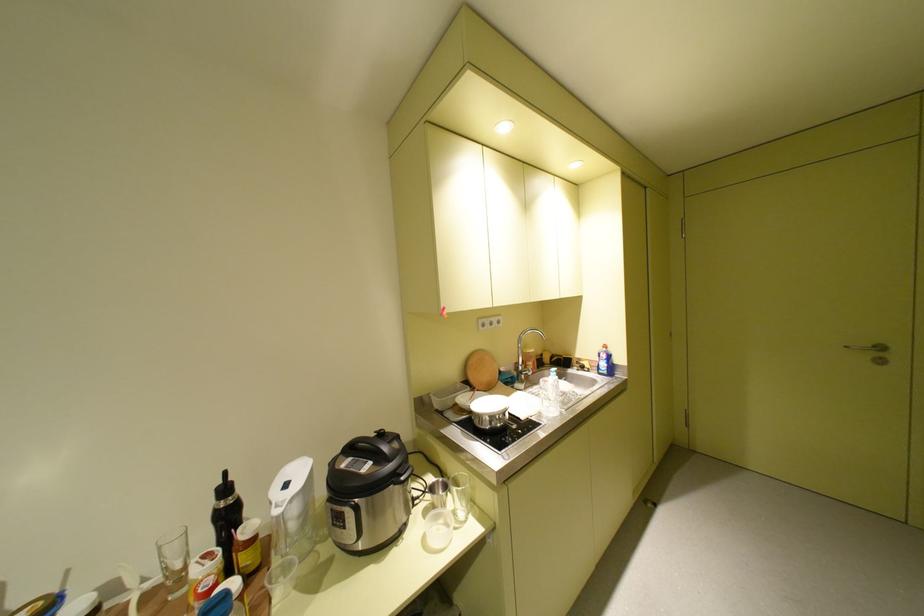
The height and width of the screenshot is (616, 924). In order to click on cooker lid handle in this screenshot , I will do `click(372, 446)`.